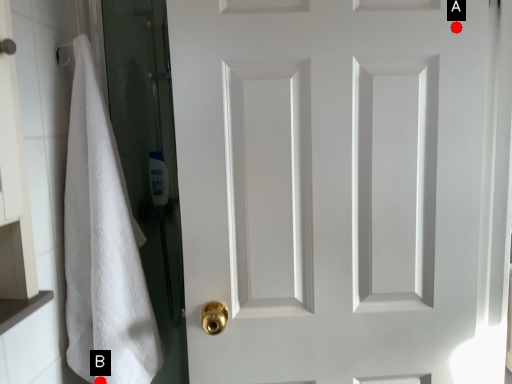
Question: Two points are circled on the image, labeled by A and B beside each circle. Among these points, which one is nearest to the camera?

Choices:
 (A) A is closer
 (B) B is closer

Answer: (A)